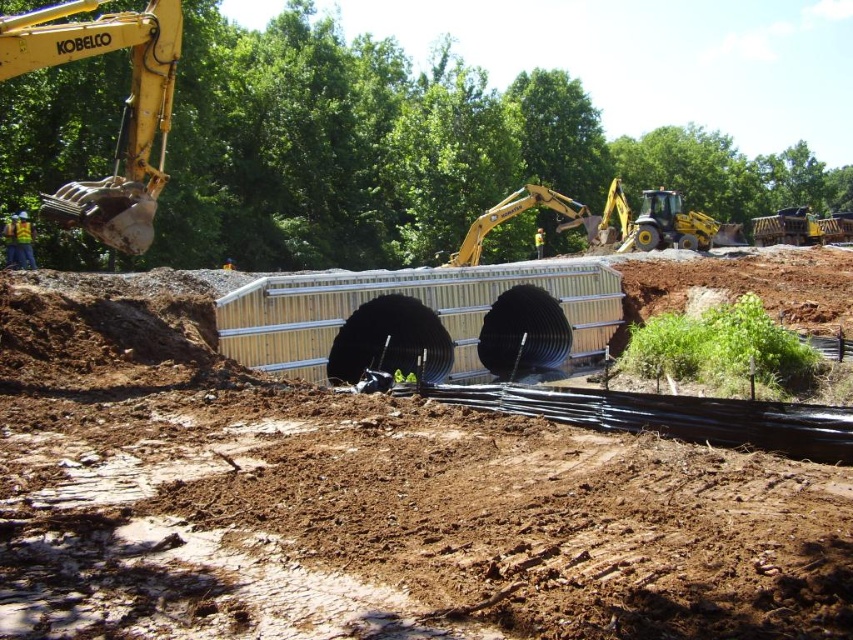
Question: Does black corrugated pipe at center have a greater width compared to yellow metallic excavator at upper left?

Choices:
 (A) no
 (B) yes

Answer: (B)

Question: Among these objects, which one is nearest to the camera?

Choices:
 (A) black corrugated pipe at center
 (B) yellow metallic excavator at upper left

Answer: (A)

Question: Is black corrugated pipe at center to the left of yellow metallic excavator at upper left from the viewer's perspective?

Choices:
 (A) no
 (B) yes

Answer: (A)

Question: Considering the relative positions of black corrugated pipe at center and yellow metallic excavator at upper left in the image provided, where is black corrugated pipe at center located with respect to yellow metallic excavator at upper left?

Choices:
 (A) above
 (B) below

Answer: (B)